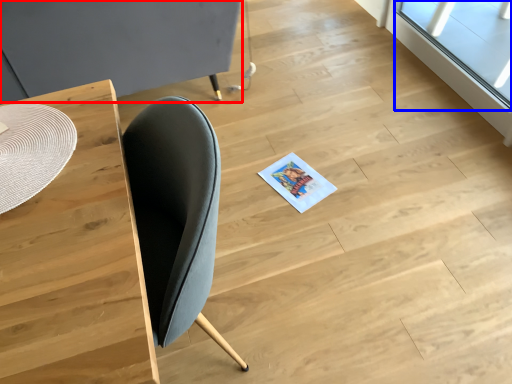
Question: Which object is further to the camera taking this photo, round table (highlighted by a red box) or window (highlighted by a blue box)?

Choices:
 (A) round table
 (B) window

Answer: (B)